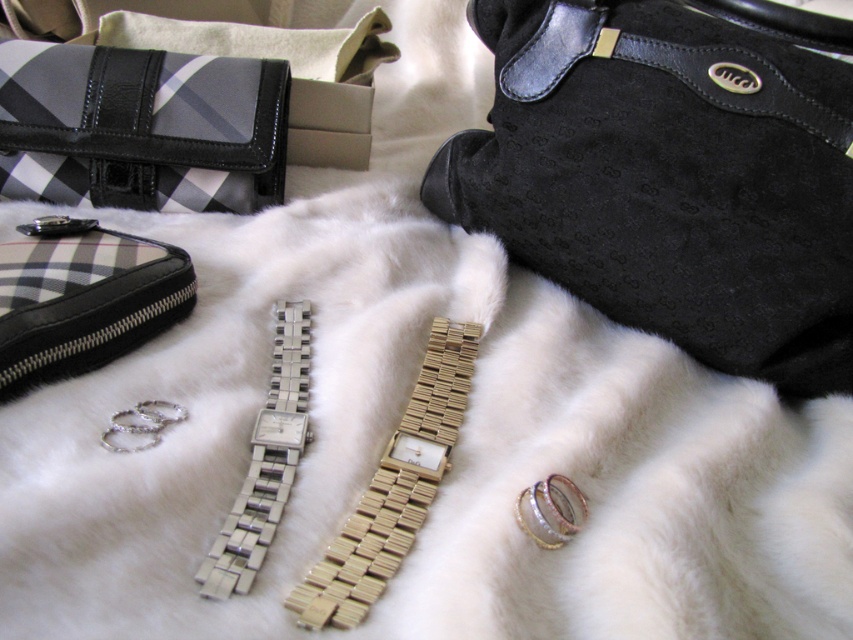
Question: Estimate the real-world distances between objects in this image. Which object is closer to the suede leather strap at upper right?

Choices:
 (A) suede black handbag at upper right
 (B) silver metallic watch at center
 (C) black leather wallet at upper left
 (D) gold metallic watch at center

Answer: (A)

Question: Which point is closer to the camera taking this photo?

Choices:
 (A) (254, 422)
 (B) (366, 611)
 (C) (44, 365)
 (D) (714, 180)

Answer: (B)

Question: Is suede black handbag at upper right bigger than black leather wallet at upper left?

Choices:
 (A) no
 (B) yes

Answer: (B)

Question: Which point appears closest to the camera in this image?

Choices:
 (A) (143, 157)
 (B) (548, 68)
 (C) (86, 314)

Answer: (C)

Question: Is gold metallic watch at center to the left of silver metallic watch at center from the viewer's perspective?

Choices:
 (A) yes
 (B) no

Answer: (B)

Question: Is suede black handbag at upper right below black checkered fabric wallet at upper left?

Choices:
 (A) no
 (B) yes

Answer: (A)